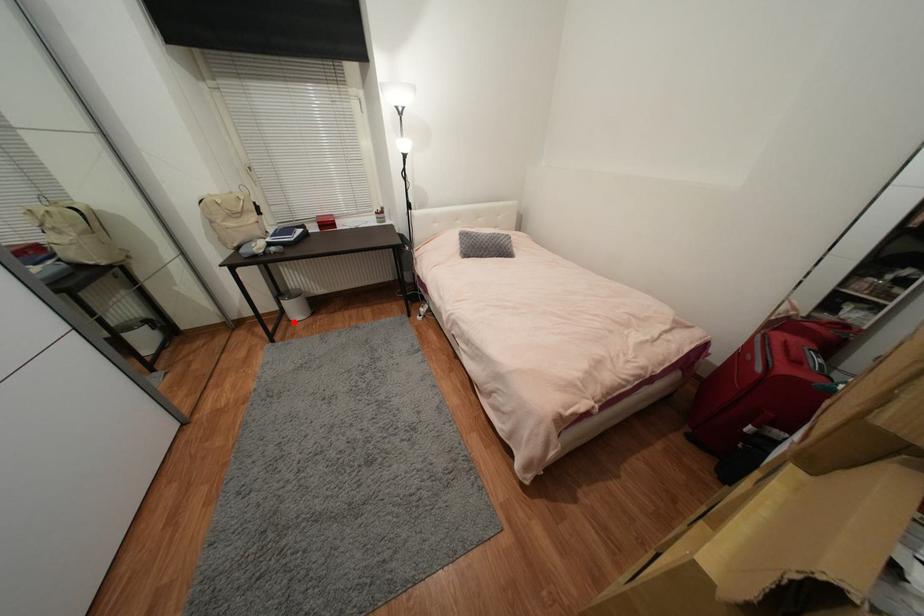
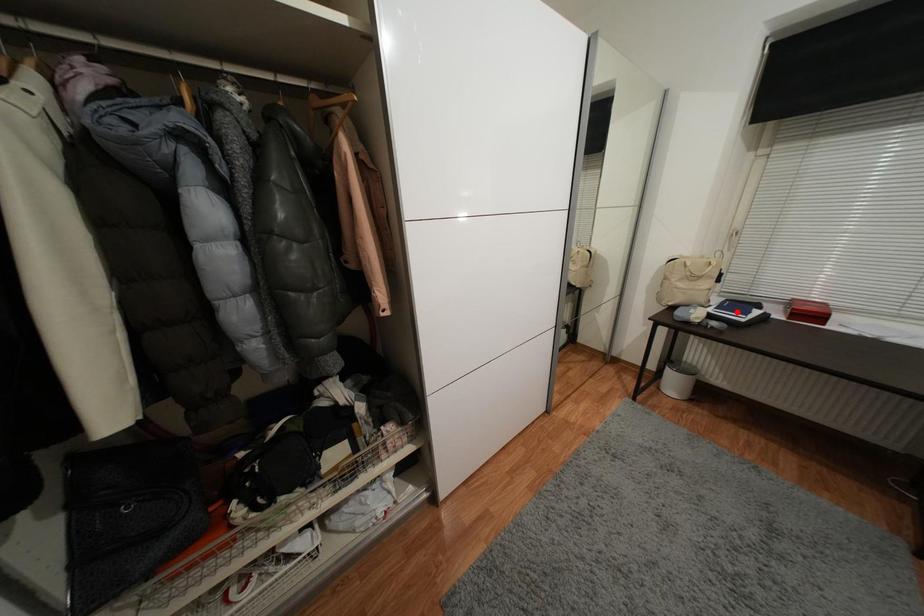
I am providing you with two images of the same scene from different viewpoints. A red point is marked on the first image and another point is marked on the second image. Do the highlighted points in image1 and image2 indicate the same real-world spot?

No